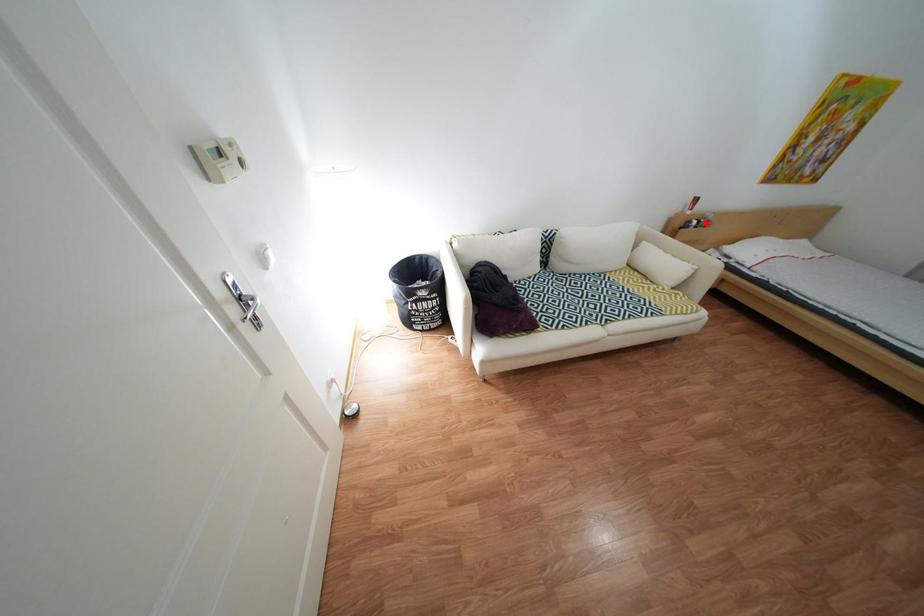
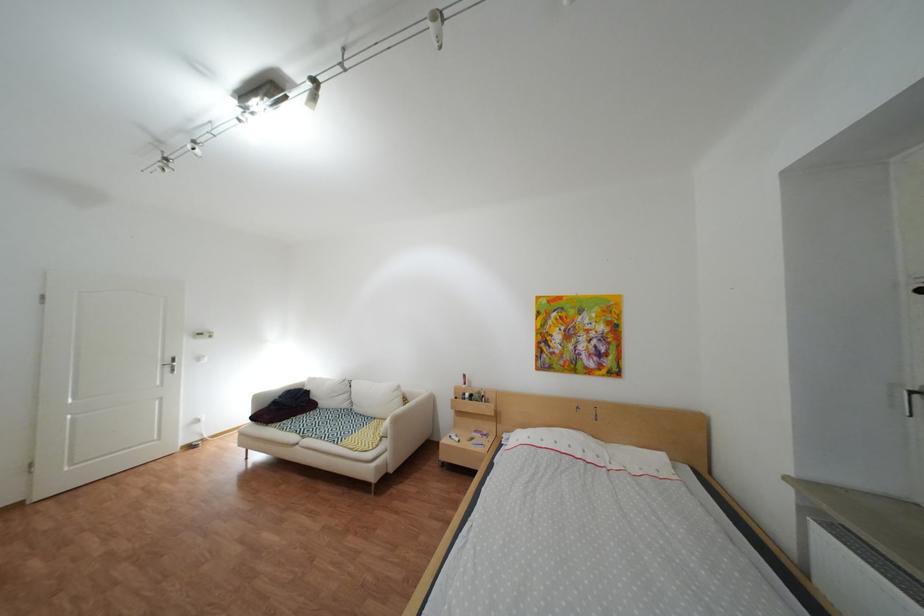
Find the pixel in the second image that matches the highlighted location in the first image.

(480, 395)